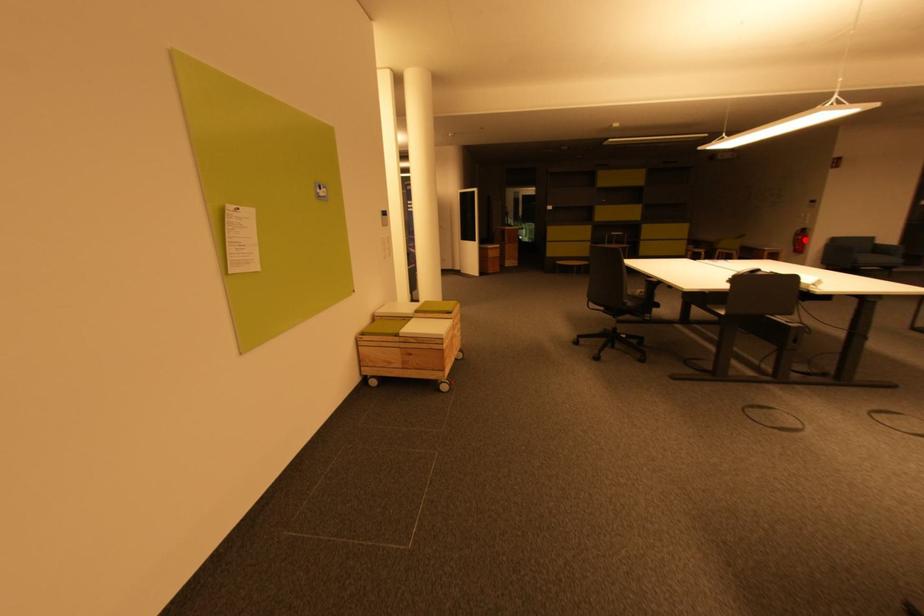
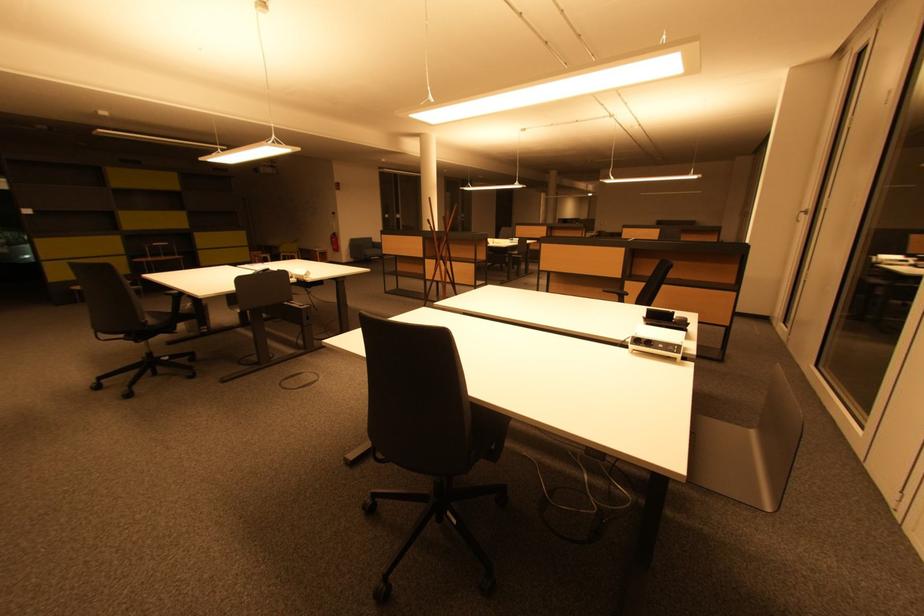
Question: I am providing you with two images of the same scene from different viewpoints. A red point is marked on the first image. At the location where the point appears in image 1, is it still visible in image 2?

Choices:
 (A) Yes
 (B) No

Answer: (A)